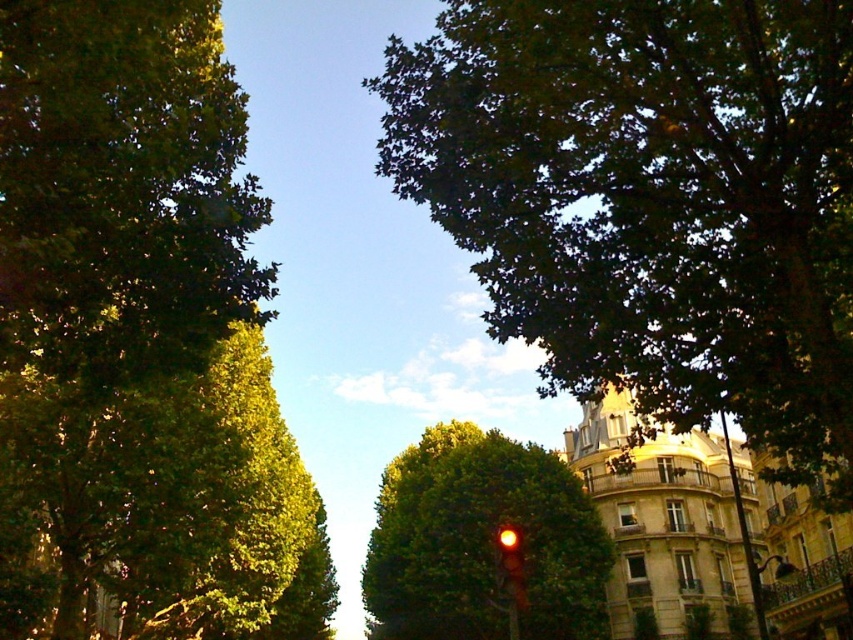
Is green leafy tree at upper left in front of green leafy tree at upper right?

Yes, it is.

How much distance is there between green leafy tree at upper left and green leafy tree at upper right?

117.62 feet

The width and height of the screenshot is (853, 640). Identify the location of green leafy tree at upper left. (140, 340).

How distant is green leafy tree at upper left from green leafy tree at center?

green leafy tree at upper left is 32.41 meters from green leafy tree at center.

You are a GUI agent. You are given a task and a screenshot of the screen. Output one action in this format:
    pyautogui.click(x=<x>, y=<y>)
    Task: Click on the green leafy tree at upper left
    This screenshot has width=853, height=640.
    Given the screenshot: What is the action you would take?
    pyautogui.click(x=140, y=340)

The image size is (853, 640). What do you see at coordinates (140, 340) in the screenshot?
I see `green leafy tree at upper left` at bounding box center [140, 340].

This screenshot has width=853, height=640. Find the location of `green leafy tree at upper left`. green leafy tree at upper left is located at coordinates (140, 340).

Who is higher up, green leafy tree at center or red glass traffic light at center?

red glass traffic light at center is above.

Does point (445, 468) lie in front of point (512, 545)?

No.

At what (x,y) coordinates should I click in order to perform the action: click on green leafy tree at center. Please return your answer as a coordinate pair (x, y). The width and height of the screenshot is (853, 640). Looking at the image, I should click on (482, 541).